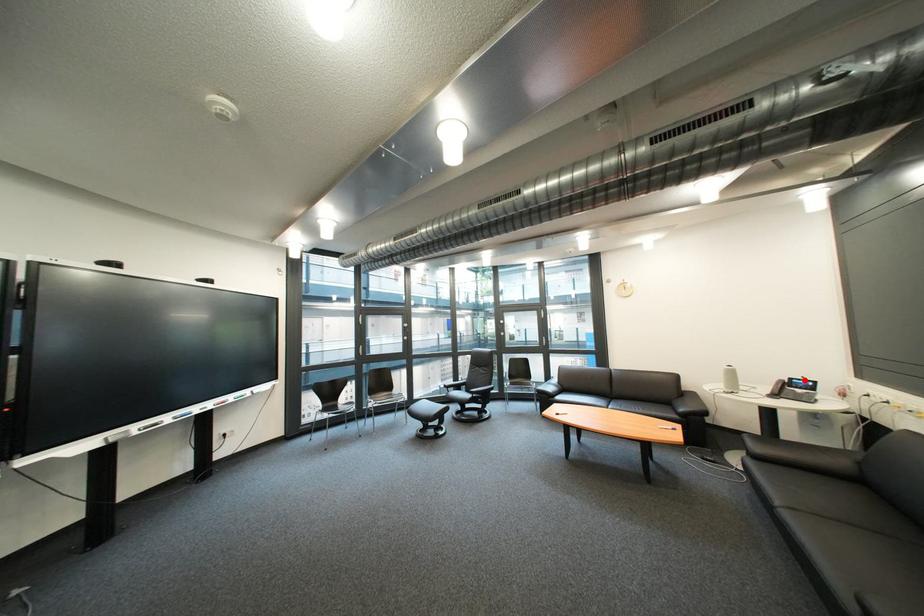
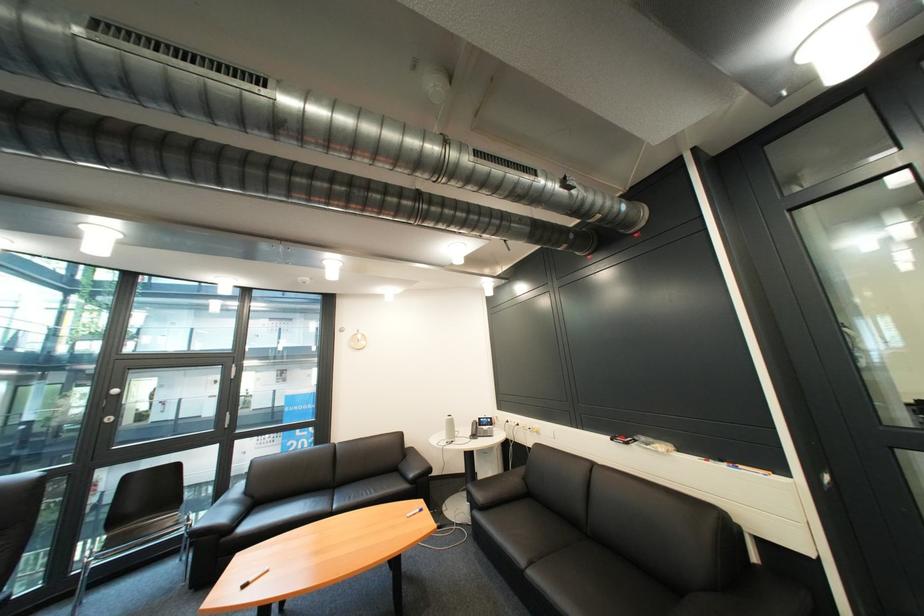
Question: I am providing you with two images of the same scene from different viewpoints. A red point is shown in image1. For the corresponding object point in image2, is it positioned nearer or farther from the camera?

Choices:
 (A) Nearer
 (B) Farther

Answer: (B)